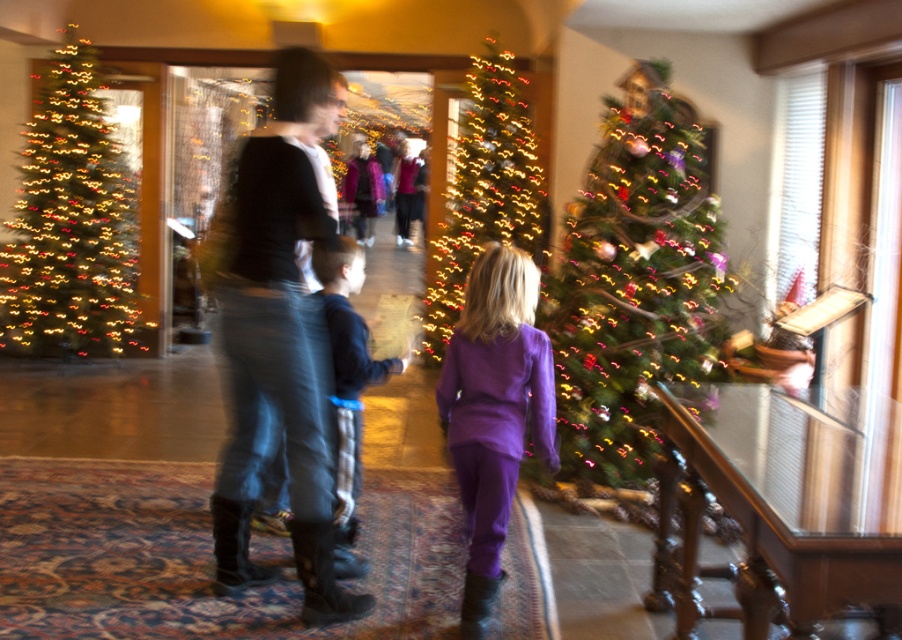
You are planning to place a 1.8m tall artificial tree in the center of the room. The room has a 2.5m ceiling height. Considering the height of the shiny green tree at center and the illuminated glass christmas tree at center, will the new tree fit without touching the ceiling?

The shiny green tree at center has a lesser height compared to the illuminated glass christmas tree at center. However, since the tallest tree mentioned is the illuminated glass christmas tree at center, we can assume it is shorter than or equal to the ceiling height. If the new 1.8m tree is shorter than the ceiling height of 2.5m, it will fit without touching the ceiling. However, without knowing the exact height of the existing trees, we cannot confirm if the new tree will fit based on the given info.

You are a guest at this holiday party and want to find a place to sit. You see the purple matte pants at center and the velvet purple coat at center. Which one is more likely to be an actual seating area?

The velvet purple coat at center is larger than the purple matte pants at center, so it is more likely to be an actual seating area.

You are standing at point (633, 280) in the festive indoor scene. What object is located exactly at your current position?

The shiny green tree at center is located exactly at point (633, 280).